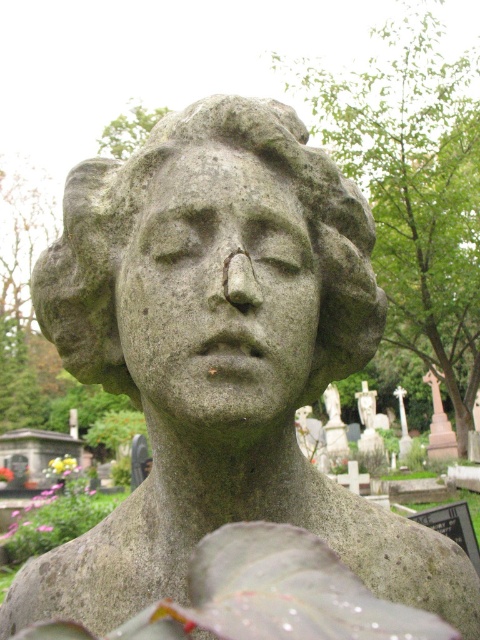
Question: Does gray stone face at center appear under gray stone bust at center?

Choices:
 (A) no
 (B) yes

Answer: (B)

Question: Observing the image, what is the correct spatial positioning of gray stone face at center in reference to gray stone bust at center?

Choices:
 (A) right
 (B) left

Answer: (A)

Question: Which point appears closest to the camera in this image?

Choices:
 (A) (367, 294)
 (B) (180, 188)

Answer: (B)

Question: Does gray stone face at center have a greater width compared to gray stone bust at center?

Choices:
 (A) yes
 (B) no

Answer: (B)